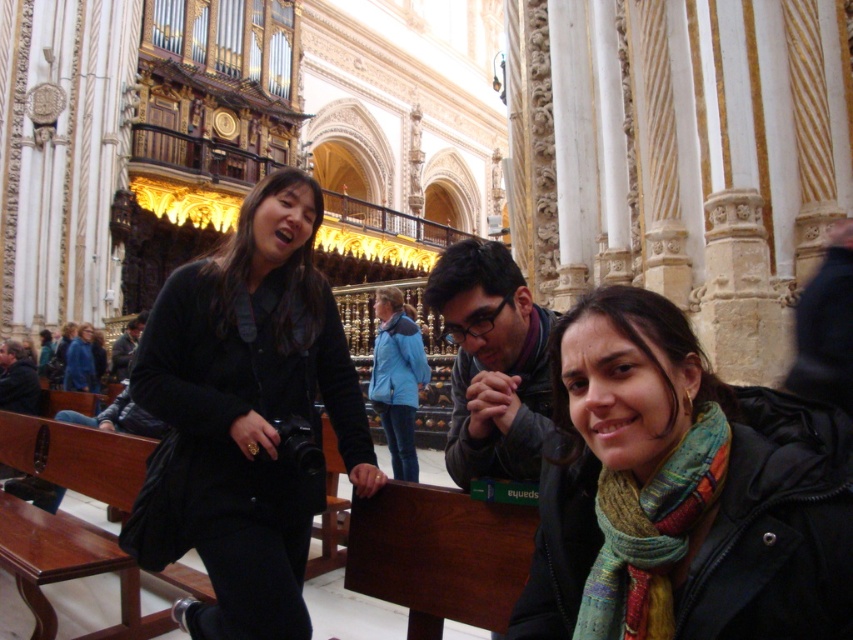
How much distance is there between matte black jacket at center and dark gray jacket at center?

matte black jacket at center is 33.45 meters from dark gray jacket at center.

Does point (534, 456) lie in front of point (125, 330)?

Yes, point (534, 456) is closer to viewer.

Image resolution: width=853 pixels, height=640 pixels. What do you see at coordinates (492, 362) in the screenshot? I see `matte black jacket at center` at bounding box center [492, 362].

You are a GUI agent. You are given a task and a screenshot of the screen. Output one action in this format:
    pyautogui.click(x=<x>, y=<y>)
    Task: Click on the matte black jacket at center
    The image size is (853, 640).
    Given the screenshot: What is the action you would take?
    pyautogui.click(x=492, y=362)

Is black matte jacket at center above blue denim jacket at center?

Indeed, black matte jacket at center is positioned over blue denim jacket at center.

Can you confirm if black matte jacket at center is taller than blue denim jacket at center?

Yes, black matte jacket at center is taller than blue denim jacket at center.

Describe the element at coordinates (253, 406) in the screenshot. I see `black matte jacket at center` at that location.

The image size is (853, 640). I want to click on black matte jacket at center, so click(253, 406).

Image resolution: width=853 pixels, height=640 pixels. What do you see at coordinates (682, 492) in the screenshot?
I see `multicolored scarf at lower right` at bounding box center [682, 492].

You are a GUI agent. You are given a task and a screenshot of the screen. Output one action in this format:
    pyautogui.click(x=<x>, y=<y>)
    Task: Click on the multicolored scarf at lower right
    This screenshot has width=853, height=640.
    Given the screenshot: What is the action you would take?
    tap(682, 492)